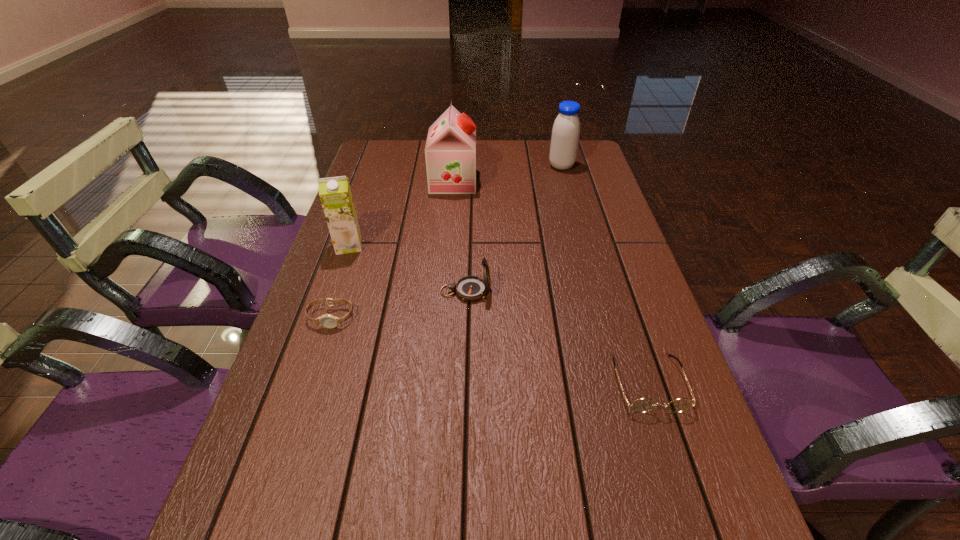
Image resolution: width=960 pixels, height=540 pixels. I want to click on vacant space located on the front of the third farthest object, so click(x=334, y=287).

You are a GUI agent. You are given a task and a screenshot of the screen. Output one action in this format:
    pyautogui.click(x=<x>, y=<y>)
    Task: Click on the vacant space located 0.180m on the face of the compass
    The image size is (960, 540).
    Given the screenshot: What is the action you would take?
    pyautogui.click(x=567, y=292)

Locate an element on the screen. The image size is (960, 540). free spot located on the lenses of the nearest object is located at coordinates (675, 463).

I want to click on vacant space situated 0.320m on the face of the watch, so click(278, 478).

Locate an element on the screen. This screenshot has width=960, height=540. soya milk that is at the left edge is located at coordinates point(335,194).

Find the location of `watch positioned at the left edge`. watch positioned at the left edge is located at coordinates (328, 321).

Locate an element on the screen. soya milk that is at the right edge is located at coordinates (566, 129).

Find the location of a particular element. spectacles that is at the right edge is located at coordinates (642, 405).

Where is `object located at the far right corner`? This screenshot has height=540, width=960. object located at the far right corner is located at coordinates (566, 129).

Locate an element on the screen. Image resolution: width=960 pixels, height=540 pixels. vacant region at the left edge of the desktop is located at coordinates point(365,272).